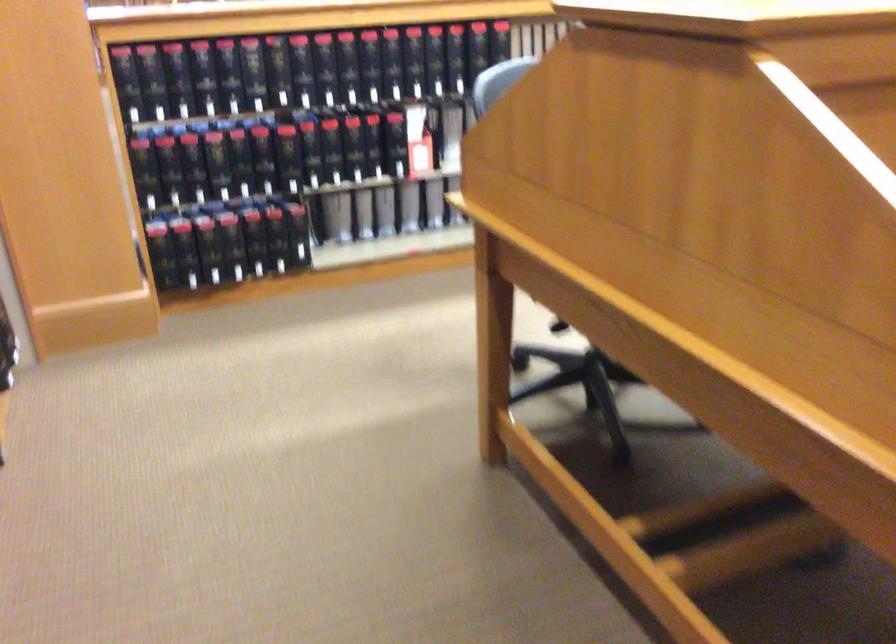
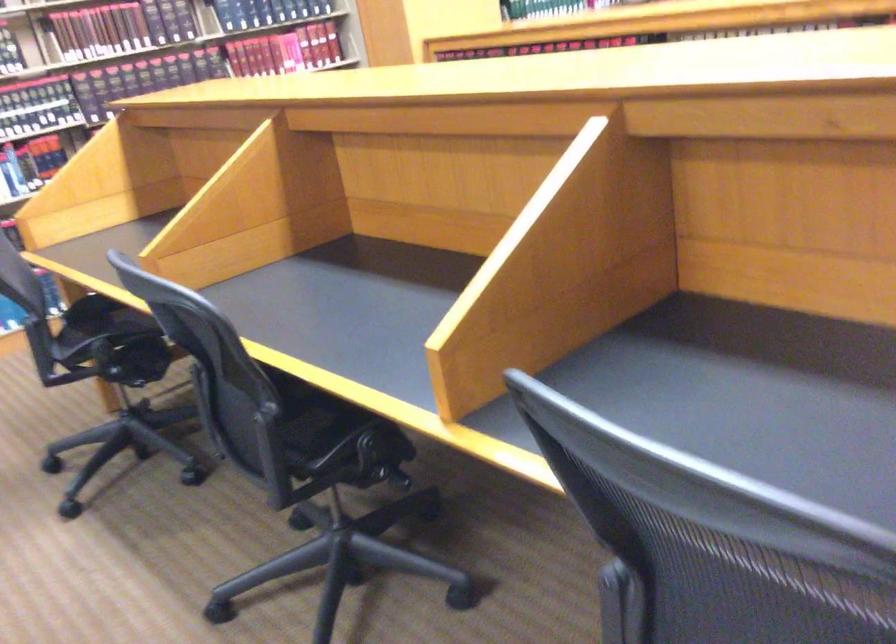
Question: I am providing you with two images of the same scene from different viewpoints. Which of the following objects are not visible in image2?

Choices:
 (A) hardcover book
 (B) green plant pot
 (C) black binder book
 (D) chair sitting surface

Answer: (C)